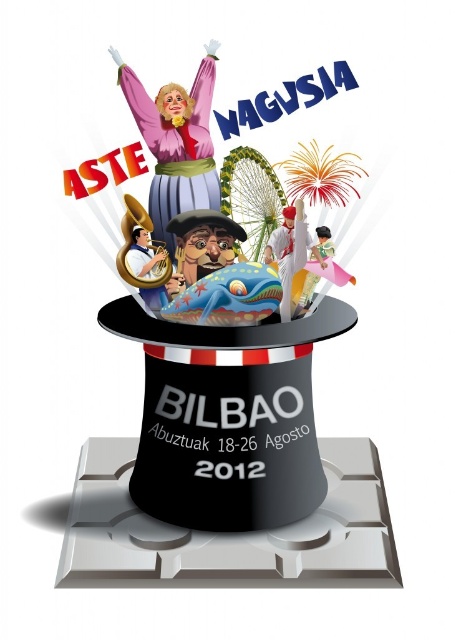
Which is above, matte black hat at center or matte pink dress at upper center?

matte pink dress at upper center is above.

Is point (337, 468) closer to viewer compared to point (196, 97)?

No, it is not.

I want to click on matte black hat at center, so click(229, 461).

Identify the location of matte black hat at center. (229, 461).